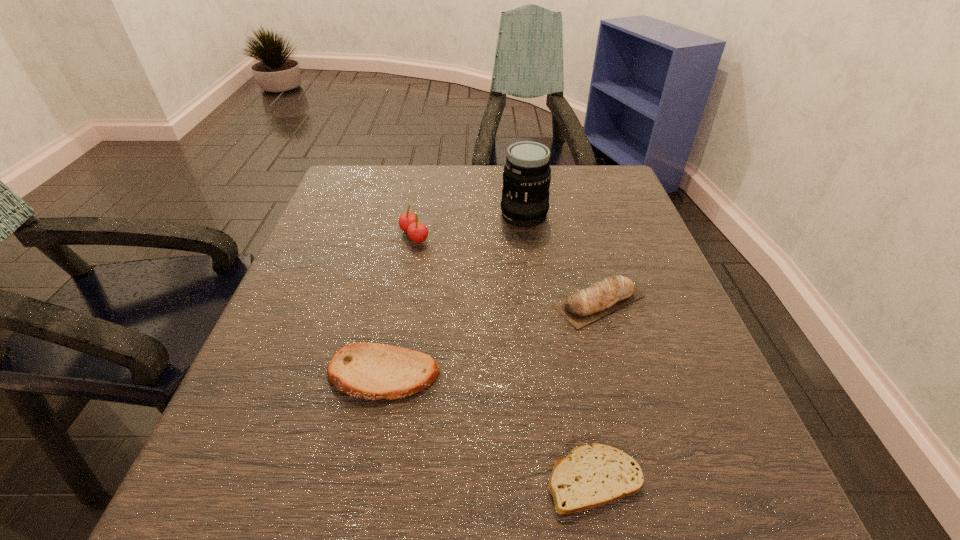
I want to click on free space between the second shortest pita bread and the cherry, so click(x=398, y=305).

Find the location of `free space between the tallest object and the second tallest object`. free space between the tallest object and the second tallest object is located at coordinates (469, 226).

Identify the location of empty location between the nearest object and the second farthest pita bread. The height and width of the screenshot is (540, 960). (489, 427).

Find the location of `vacant area between the third tallest object and the tallest object`. vacant area between the third tallest object and the tallest object is located at coordinates (562, 258).

Identify which object is located as the nearest to the shortest object. Please provide its 2D coordinates. Your answer should be formatted as a tuple, i.e. [(x, y)], where the tuple contains the x and y coordinates of a point satisfying the conditions above.

[(371, 371)]

Locate which object is the third closest to the cherry. Please provide its 2D coordinates. Your answer should be formatted as a tuple, i.e. [(x, y)], where the tuple contains the x and y coordinates of a point satisfying the conditions above.

[(371, 371)]

Locate which pita bread ranks second in proximity to the third nearest object. Please provide its 2D coordinates. Your answer should be formatted as a tuple, i.e. [(x, y)], where the tuple contains the x and y coordinates of a point satisfying the conditions above.

[(594, 475)]

Identify which pita bread is the closest to the third farthest object. Please provide its 2D coordinates. Your answer should be formatted as a tuple, i.e. [(x, y)], where the tuple contains the x and y coordinates of a point satisfying the conditions above.

[(371, 371)]

At what (x,y) coordinates should I click in order to perform the action: click on vacant area in the image that satisfies the following two spatial constraints: 1. on the back side of the telephoto lens; 2. on the right side of the second tallest object. Please return your answer as a coordinate pair (x, y). Looking at the image, I should click on (419, 215).